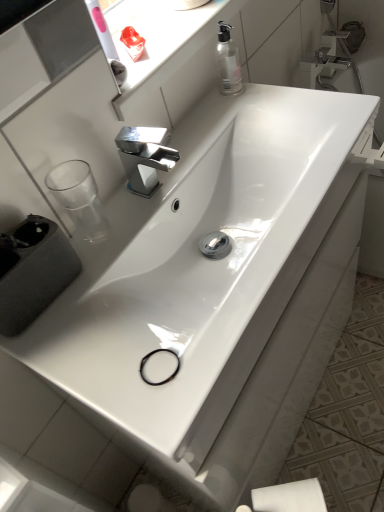
Question: Looking at their shapes, would you say white glossy sink at center, which is the second sink from back to front, is wider or thinner than transparent plastic window sill at upper center?

Choices:
 (A) wide
 (B) thin

Answer: (A)

Question: Is point (332, 174) closer or farther from the camera than point (200, 31)?

Choices:
 (A) farther
 (B) closer

Answer: (B)

Question: Based on their relative distances, which object is nearer to the transparent plastic window sill at upper center?

Choices:
 (A) white matte toilet paper at lower right
 (B) white glossy sink at center, placed as the second sink when sorted from front to back
 (C) white glossy sink at center, the first sink viewed from the front
 (D) transparent plastic soap dispenser at upper right
 (E) polished chrome faucet at center

Answer: (D)

Question: Estimate the real-world distances between objects in this image. Which object is closer to the transparent plastic soap dispenser at upper right?

Choices:
 (A) transparent plastic window sill at upper center
 (B) polished chrome faucet at center
 (C) white matte toilet paper at lower right
 (D) white glossy sink at center, arranged as the 1th sink when viewed from the back
 (E) white glossy sink at center, which is the second sink from back to front

Answer: (A)